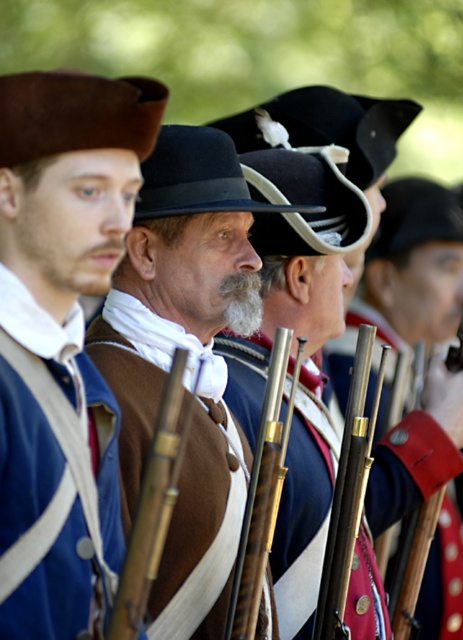
You are a historian examining this Revolutionary War reenactment scene. You notice the brown suede hat at center and the shiny gold rifle at center. Which object appears taller in the image?

The brown suede hat at center is taller than the shiny gold rifle at center.